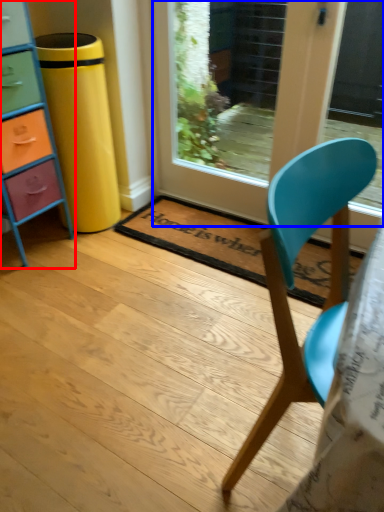
Question: Which of the following is the closest to the observer, chest of drawers (highlighted by a red box) or door (highlighted by a blue box)?

Choices:
 (A) chest of drawers
 (B) door

Answer: (A)